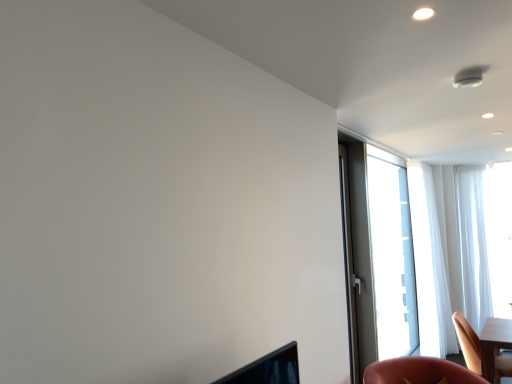
Question: Is wooden chair at lower right oriented towards matte gray screen door at right?

Choices:
 (A) yes
 (B) no

Answer: (B)

Question: Can you confirm if wooden chair at lower right is positioned to the right of matte gray screen door at right?

Choices:
 (A) no
 (B) yes

Answer: (B)

Question: From a real-world perspective, is wooden chair at lower right on top of matte gray screen door at right?

Choices:
 (A) no
 (B) yes

Answer: (A)

Question: Does wooden chair at lower right have a lesser width compared to matte gray screen door at right?

Choices:
 (A) yes
 (B) no

Answer: (B)

Question: Considering the relative sizes of wooden chair at lower right and matte gray screen door at right in the image provided, is wooden chair at lower right taller than matte gray screen door at right?

Choices:
 (A) no
 (B) yes

Answer: (A)

Question: From the image's perspective, does wooden chair at lower right appear lower than matte gray screen door at right?

Choices:
 (A) no
 (B) yes

Answer: (B)

Question: Can you confirm if wooden chair at lower right is positioned to the left of white sheer curtain at right, which is the second curtain in right-to-left order?

Choices:
 (A) no
 (B) yes

Answer: (B)

Question: From a real-world perspective, is wooden chair at lower right positioned over white sheer curtain at right, arranged as the first curtain when viewed from the left, based on gravity?

Choices:
 (A) yes
 (B) no

Answer: (B)

Question: Could you tell me if wooden chair at lower right is turned towards white sheer curtain at right, which is the second curtain in right-to-left order?

Choices:
 (A) yes
 (B) no

Answer: (B)

Question: From the image's perspective, is wooden chair at lower right beneath white sheer curtain at right, which is the second curtain in right-to-left order?

Choices:
 (A) yes
 (B) no

Answer: (A)

Question: From a real-world perspective, is wooden chair at lower right located beneath white sheer curtain at right, which is the second curtain in right-to-left order?

Choices:
 (A) yes
 (B) no

Answer: (A)

Question: Is wooden chair at lower right smaller than white sheer curtain at right, which is the second curtain in right-to-left order?

Choices:
 (A) yes
 (B) no

Answer: (A)

Question: Does wooden chair at lower right turn towards transparent glass window at right?

Choices:
 (A) yes
 (B) no

Answer: (B)